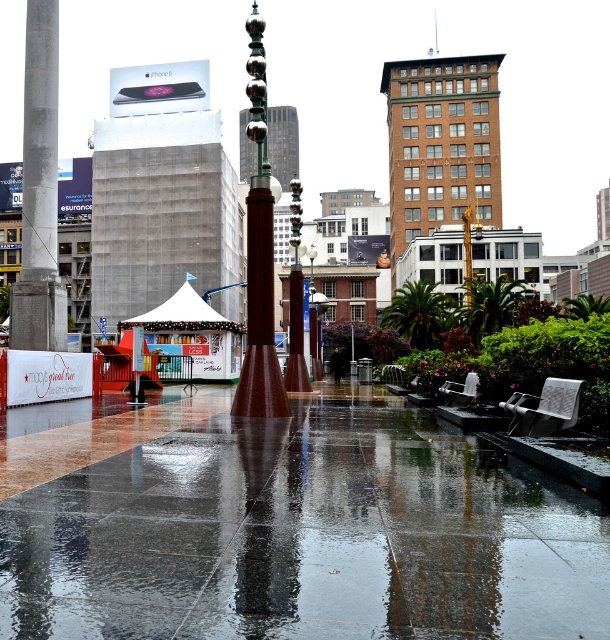
Which is behind, point (396, 184) or point (29, 116)?

Positioned behind is point (396, 184).

Does brown brick building at upper center have a greater height compared to concrete column at left?

Yes, brown brick building at upper center is taller than concrete column at left.

Which is behind, point (440, 120) or point (29, 161)?

Positioned behind is point (440, 120).

Where is `brown brick building at upper center`? The image size is (610, 640). brown brick building at upper center is located at coordinates (442, 145).

Is polished bronze pole at center shorter than shiny brown pole at center?

Yes, polished bronze pole at center is shorter than shiny brown pole at center.

Between polished bronze pole at center and shiny brown pole at center, which one is positioned higher?

Positioned higher is shiny brown pole at center.

Between point (249, 340) and point (298, 291), which one is positioned behind?

The point (298, 291) is more distant.

Locate an element on the screen. The height and width of the screenshot is (640, 610). polished bronze pole at center is located at coordinates (259, 256).

Is concrete column at left to the left of metallic pole at center from the viewer's perspective?

Yes, concrete column at left is to the left of metallic pole at center.

Between point (27, 138) and point (318, 353), which one is positioned behind?

The point (318, 353) is more distant.

You are a GUI agent. You are given a task and a screenshot of the screen. Output one action in this format:
    pyautogui.click(x=<x>, y=<y>)
    Task: Click on the concrete column at left
    
    Given the screenshot: What is the action you would take?
    pyautogui.click(x=40, y=192)